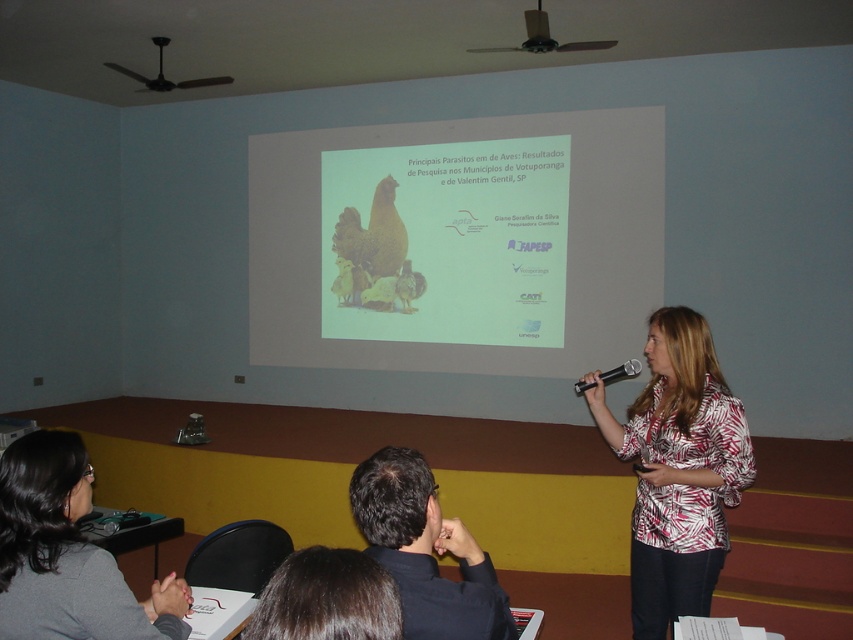
Does white printed blouse at center have a larger size compared to gray fabric at lower left?

Indeed, white printed blouse at center has a larger size compared to gray fabric at lower left.

Consider the image. Which is below, white printed blouse at center or gray fabric at lower left?

Positioned lower is white printed blouse at center.

Find the location of a particular element. white printed blouse at center is located at coordinates (677, 468).

Is matte white screen at center bigger than white printed blouse at center?

Correct, matte white screen at center is larger in size than white printed blouse at center.

Does matte white screen at center have a lesser width compared to white printed blouse at center?

No, matte white screen at center is not thinner than white printed blouse at center.

Identify the location of matte white screen at center. The width and height of the screenshot is (853, 640). (460, 243).

Does matte white screen at center have a greater width compared to metallic projector at upper center?

Indeed, matte white screen at center has a greater width compared to metallic projector at upper center.

Which is behind, point (384, 332) or point (547, 38)?

Positioned behind is point (384, 332).

Where is `matte white screen at center`? This screenshot has width=853, height=640. matte white screen at center is located at coordinates coord(460,243).